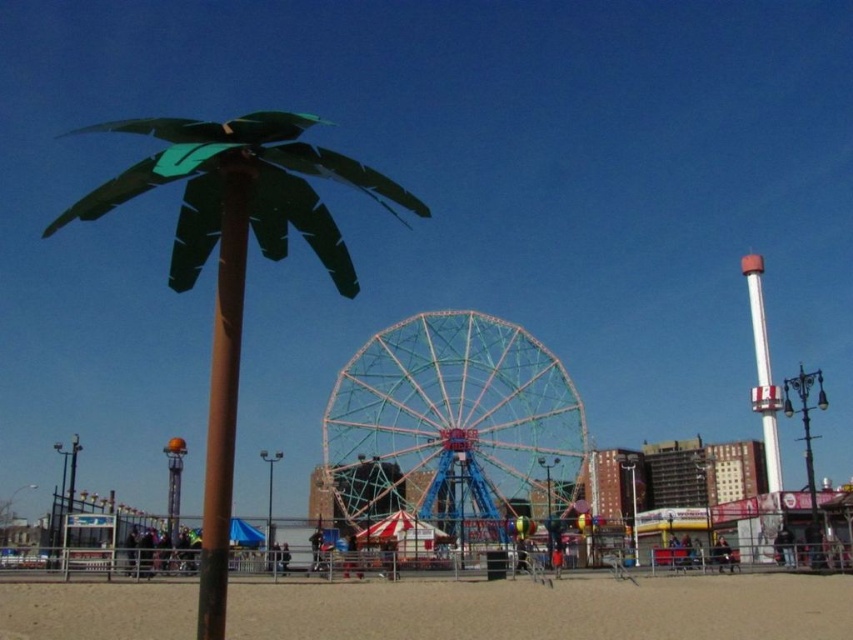
Question: Does metallic blue ferris wheel at center come behind metallic green palm tree at left?

Choices:
 (A) no
 (B) yes

Answer: (B)

Question: Which object appears closest to the camera in this image?

Choices:
 (A) white glossy pole at right
 (B) metallic green palm tree at left
 (C) metallic blue ferris wheel at center
 (D) brown matte pole at center

Answer: (B)

Question: Which of these objects is positioned farthest from the metallic blue ferris wheel at center?

Choices:
 (A) white glossy pole at right
 (B) brown matte pole at center
 (C) metallic green palm tree at left

Answer: (C)

Question: Can you confirm if metallic blue ferris wheel at center is thinner than metallic green palm tree at left?

Choices:
 (A) yes
 (B) no

Answer: (A)

Question: Does metallic green palm tree at left appear under white glossy pole at right?

Choices:
 (A) no
 (B) yes

Answer: (A)

Question: Which point is closer to the camera taking this photo?

Choices:
 (A) (488, 348)
 (B) (210, 609)
 (C) (213, 200)

Answer: (B)